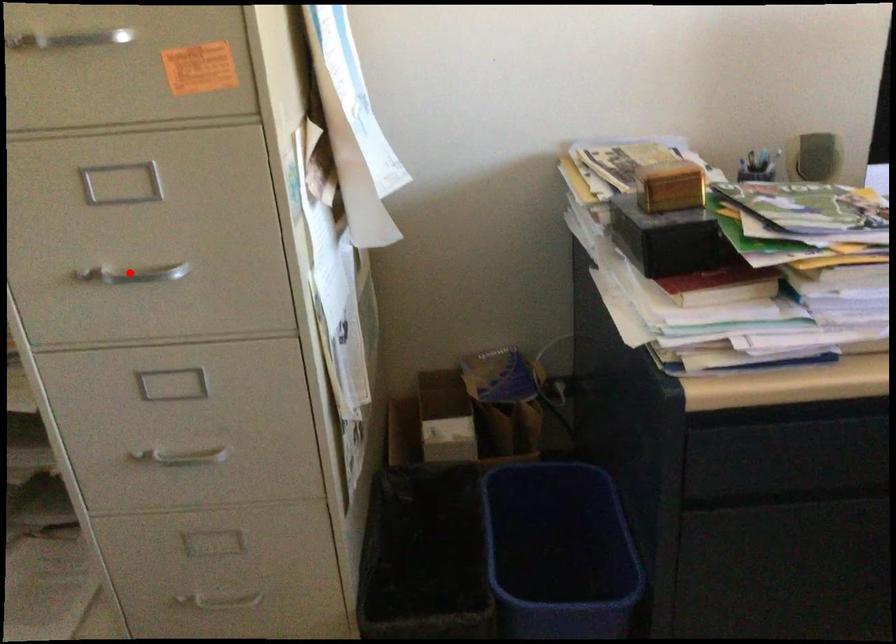
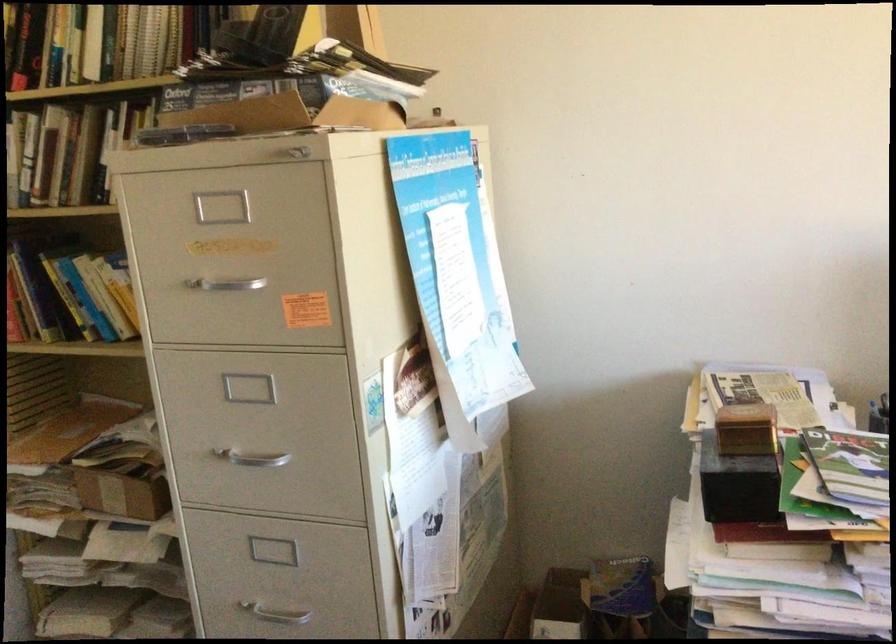
The point at the highlighted location is marked in the first image. Where is the corresponding point in the second image?

(251, 458)